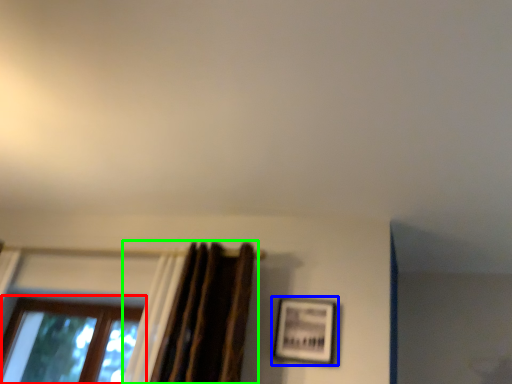
Question: Which object is positioned farthest from window (highlighted by a red box)? Select from picture frame (highlighted by a blue box) and curtain (highlighted by a green box).

Choices:
 (A) picture frame
 (B) curtain

Answer: (A)